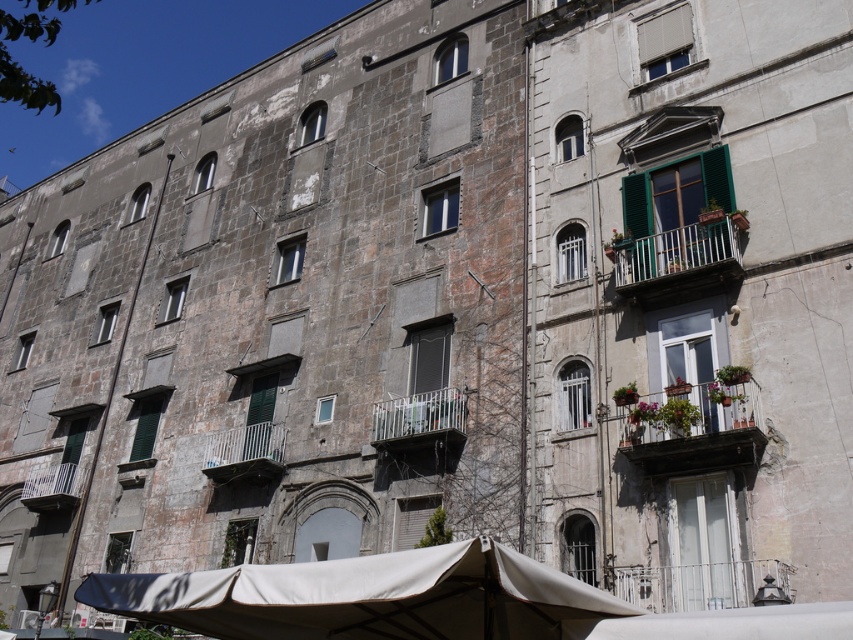
Find the location of a particular element. beige fabric canopy at lower center is located at coordinates (364, 596).

At what (x,y) coordinates should I click in order to perform the action: click on beige fabric canopy at lower center. Please return your answer as a coordinate pair (x, y). Looking at the image, I should click on (364, 596).

Who is positioned more to the right, white metal balcony at upper right or metallic silver balcony at center?

Positioned to the right is white metal balcony at upper right.

Is point (676, 282) positioned after point (265, 433)?

No.

Image resolution: width=853 pixels, height=640 pixels. Find the location of `white metal balcony at upper right`. white metal balcony at upper right is located at coordinates (677, 259).

Is beige fabric canopy at lower center further to camera compared to white painted wood balcony at right?

No, it is in front of white painted wood balcony at right.

Can you confirm if beige fabric canopy at lower center is positioned above white painted wood balcony at right?

Actually, beige fabric canopy at lower center is below white painted wood balcony at right.

Where is `beige fabric canopy at lower center`? The height and width of the screenshot is (640, 853). beige fabric canopy at lower center is located at coordinates (364, 596).